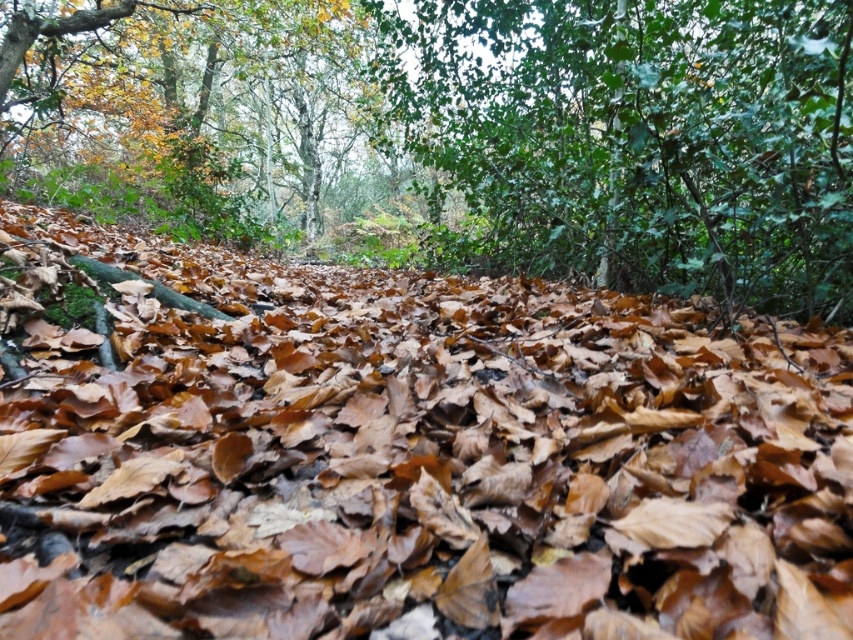
You are an environmental scientist studying the forest floor. You observe the brown leaf litter at center and the green glossy leaves at upper center. Which object is closer to the ground?

The brown leaf litter at center is closer to the ground since it is not as tall as the green glossy leaves at upper center.

You are a hiker standing in the middle of the forest. You notice the brown leaf litter at center and the green glossy leaves at upper center. How far apart are these two features from your current position?

The brown leaf litter at center is 4.65 feet away from the green glossy leaves at upper center.

You are an artist sketching the forest scene. You need to decide which area to focus on for texture details. Since the brown leaf litter at center and the green glossy leaves at upper center are both present, which object has a bigger size and thus might require more detailed shading?

The brown leaf litter at center has a larger size compared to the green glossy leaves at upper center, so it would need more detailed shading due to its bigger size.